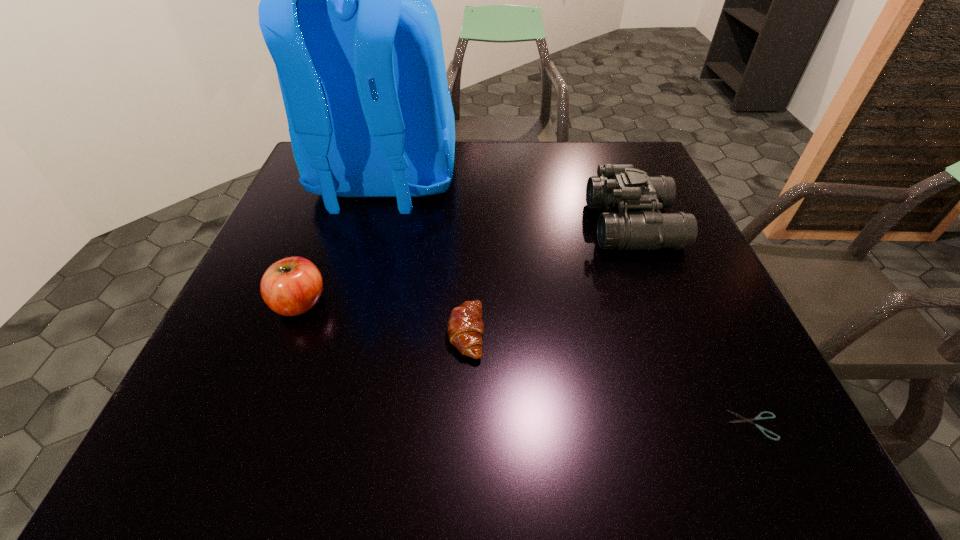
Identify the location of vacant area that lies between the third object from right to left and the third tallest object. (383, 318).

You are a GUI agent. You are given a task and a screenshot of the screen. Output one action in this format:
    pyautogui.click(x=<x>, y=<y>)
    Task: Click on the blank region between the fourth shortest object and the shortest object
    This screenshot has width=960, height=540.
    Given the screenshot: What is the action you would take?
    pyautogui.click(x=693, y=325)

You are a GUI agent. You are given a task and a screenshot of the screen. Output one action in this format:
    pyautogui.click(x=<x>, y=<y>)
    Task: Click on the empty location between the third object from left to right and the apple
    
    Given the screenshot: What is the action you would take?
    pyautogui.click(x=383, y=318)

Find the location of a particular element. free space between the third object from left to right and the apple is located at coordinates (383, 318).

The width and height of the screenshot is (960, 540). What are the coordinates of `free space between the second tallest object and the third object from left to right` in the screenshot? It's located at (549, 279).

This screenshot has width=960, height=540. Identify the location of vacant region between the apple and the backpack. (342, 244).

Locate an element on the screen. This screenshot has height=540, width=960. vacant space that is in between the fourth shortest object and the third object from left to right is located at coordinates (549, 279).

Locate an element on the screen. This screenshot has height=540, width=960. free space between the tallest object and the second shortest object is located at coordinates (425, 259).

This screenshot has height=540, width=960. What are the coordinates of `object that ranks as the closest to the fourth tallest object` in the screenshot? It's located at (346, 14).

Select which object is the fourth closest to the backpack. Please provide its 2D coordinates. Your answer should be formatted as a tuple, i.e. [(x, y)], where the tuple contains the x and y coordinates of a point satisfying the conditions above.

[(758, 417)]